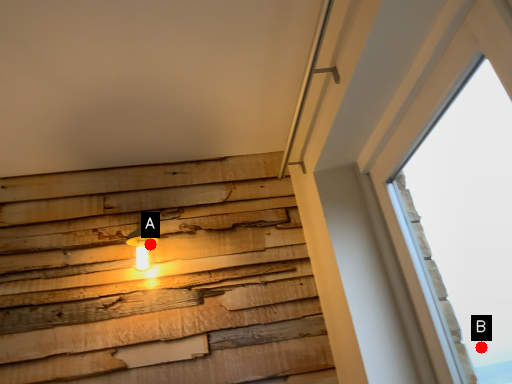
Question: Two points are circled on the image, labeled by A and B beside each circle. Among these points, which one is nearest to the camera?

Choices:
 (A) A is closer
 (B) B is closer

Answer: (B)